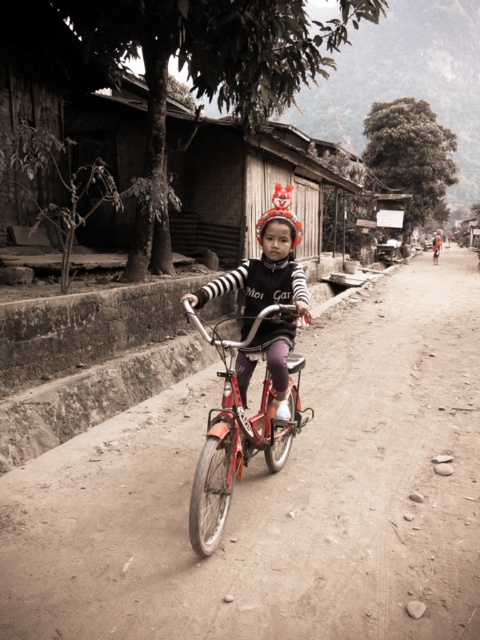
The image size is (480, 640). Describe the element at coordinates (275, 493) in the screenshot. I see `dirt track at center` at that location.

Who is taller, dirt track at center or metallic red bicycle at center?

dirt track at center is taller.

Is point (132, 448) positioned in front of point (205, 493)?

No, (132, 448) is behind (205, 493).

Identify the location of dirt track at center. This screenshot has width=480, height=640. (275, 493).

Does metallic red bicycle at center have a greater height compared to matte black shirt at center?

Incorrect, metallic red bicycle at center's height is not larger of matte black shirt at center's.

Is metallic red bicycle at center wider than matte black shirt at center?

Yes, metallic red bicycle at center is wider than matte black shirt at center.

Where is `metallic red bicycle at center`? metallic red bicycle at center is located at coordinates pyautogui.click(x=238, y=433).

Between dirt track at center and matte black shirt at center, which one has more height?

Standing taller between the two is dirt track at center.

Who is more distant from viewer, (x=251, y=404) or (x=277, y=204)?

Positioned behind is point (x=251, y=404).

At what (x,y) coordinates should I click in order to perform the action: click on dirt track at center. Please return your answer as a coordinate pair (x, y). This screenshot has width=480, height=640. Looking at the image, I should click on (275, 493).